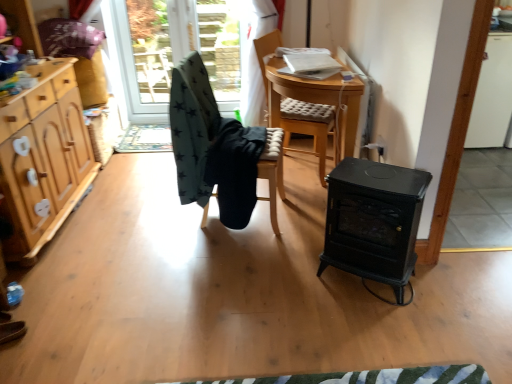
Identify the location of vacant space that's between black cast iron stove at center and black fabric chair at center, marked as the 2th chair in a right-to-left arrangement. Image resolution: width=512 pixels, height=384 pixels. (294, 239).